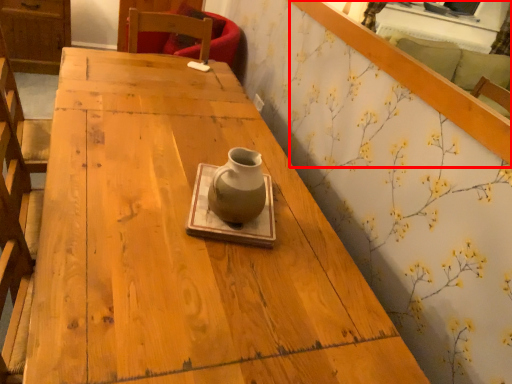
Question: Considering the relative positions of mirror (annotated by the red box) and vase in the image provided, where is mirror (annotated by the red box) located with respect to the staircase?

Choices:
 (A) left
 (B) right

Answer: (B)